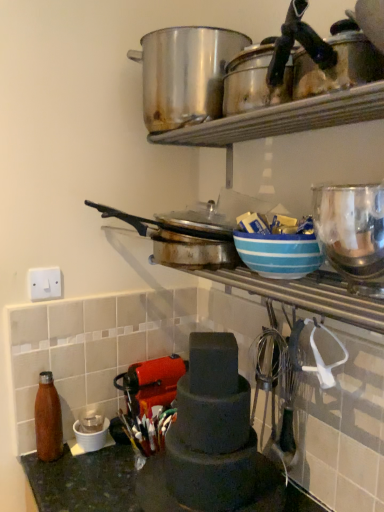
Question: Should I look upward or downward to see blue striped bowl at upper center?

Choices:
 (A) up
 (B) down

Answer: (A)

Question: Can you confirm if white plastic switch at upper left is smaller than shiny metallic pots at upper right, acting as the 1th appliance starting from the top?

Choices:
 (A) no
 (B) yes

Answer: (B)

Question: Is white plastic switch at upper left thinner than shiny metallic pots at upper right, arranged as the 2th appliance when viewed from the back?

Choices:
 (A) no
 (B) yes

Answer: (B)

Question: Could you tell me if white plastic switch at upper left is facing shiny metallic pots at upper right, acting as the 1th appliance starting from the top?

Choices:
 (A) no
 (B) yes

Answer: (A)

Question: Is white plastic switch at upper left to the right of shiny metallic pots at upper right, arranged as the 2th appliance when viewed from the back, from the viewer's perspective?

Choices:
 (A) no
 (B) yes

Answer: (A)

Question: Considering the relative sizes of white plastic switch at upper left and shiny metallic pots at upper right, acting as the 1th appliance starting from the top, in the image provided, is white plastic switch at upper left bigger than shiny metallic pots at upper right, acting as the 1th appliance starting from the top,?

Choices:
 (A) no
 (B) yes

Answer: (A)

Question: Can you confirm if white plastic switch at upper left is wider than shiny metallic pots at upper right, acting as the 1th appliance starting from the top?

Choices:
 (A) yes
 (B) no

Answer: (B)

Question: Is blue striped bowl at upper center oriented towards shiny metallic bottle at lower left?

Choices:
 (A) no
 (B) yes

Answer: (A)

Question: From the image's perspective, does blue striped bowl at upper center appear lower than shiny metallic bottle at lower left?

Choices:
 (A) yes
 (B) no

Answer: (B)

Question: Is blue striped bowl at upper center placed right next to shiny metallic bottle at lower left?

Choices:
 (A) yes
 (B) no

Answer: (B)

Question: Is blue striped bowl at upper center positioned with its back to shiny metallic bottle at lower left?

Choices:
 (A) yes
 (B) no

Answer: (B)

Question: Is blue striped bowl at upper center positioned beyond the bounds of shiny metallic bottle at lower left?

Choices:
 (A) yes
 (B) no

Answer: (A)

Question: From a real-world perspective, is blue striped bowl at upper center on shiny metallic bottle at lower left?

Choices:
 (A) yes
 (B) no

Answer: (A)

Question: Can you confirm if blue striped bowl at upper center is positioned to the right of dark green stone countertop at lower left?

Choices:
 (A) yes
 (B) no

Answer: (A)